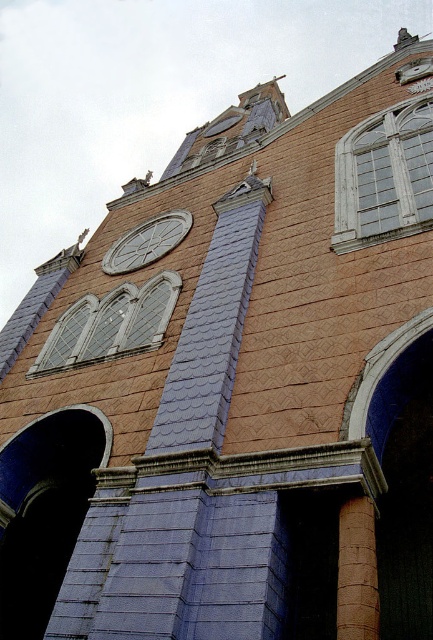
You are standing in front of the building and want to determine the relative positions of two points marked on the tower. Which point is closer to you, point (175,284) or point (115,253)?

Point (175,284) is closer to the viewer than point (115,253).

You are an architect designing a new building and want to place a window at the same location as the white wooden window at upper right in the image. What are the coordinates of this window?

The coordinates of the white wooden window at upper right are at point (x=384, y=177).